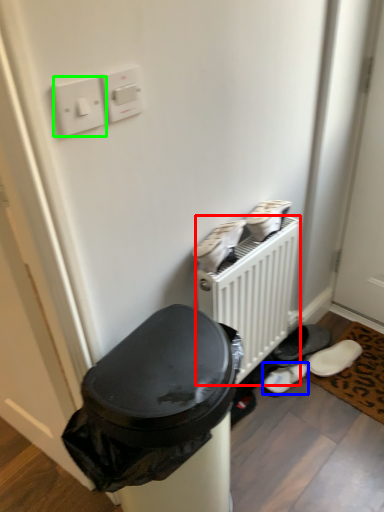
Question: Based on their relative distances, which object is nearer to radiator (highlighted by a red box)? Choose from footwear (highlighted by a blue box) and light switch (highlighted by a green box).

Choices:
 (A) footwear
 (B) light switch

Answer: (A)